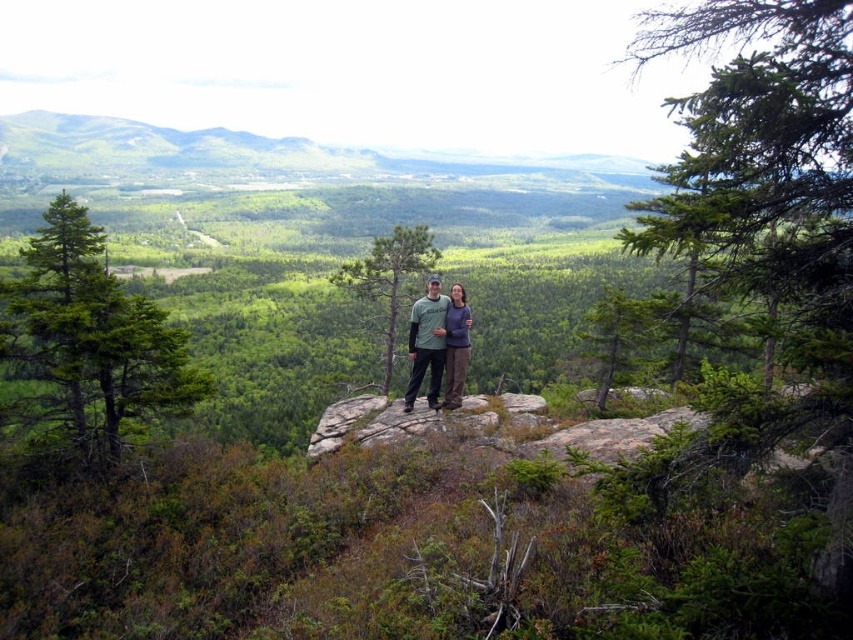
Does green matte tree at left appear under gray fabric jacket at center?

No, green matte tree at left is not below gray fabric jacket at center.

Between point (51, 273) and point (453, 401), which one is positioned in front?

Point (453, 401) is in front.

The image size is (853, 640). I want to click on green matte tree at left, so click(91, 339).

Is green needle-like foliage at upper right below gray fabric jacket at center?

No, green needle-like foliage at upper right is not below gray fabric jacket at center.

Between green needle-like foliage at upper right and gray fabric jacket at center, which one appears on the left side from the viewer's perspective?

gray fabric jacket at center is more to the left.

What do you see at coordinates (764, 154) in the screenshot? I see `green needle-like foliage at upper right` at bounding box center [764, 154].

Identify the location of green needle-like foliage at upper right. This screenshot has width=853, height=640. (764, 154).

Can you confirm if green needle-like foliage at upper right is shorter than matte green t-shirt at center?

No, green needle-like foliage at upper right is not shorter than matte green t-shirt at center.

Which is behind, point (688, 115) or point (431, 275)?

Positioned behind is point (688, 115).

Find the location of a particular element. Image resolution: width=853 pixels, height=640 pixels. green needle-like foliage at upper right is located at coordinates click(x=764, y=154).